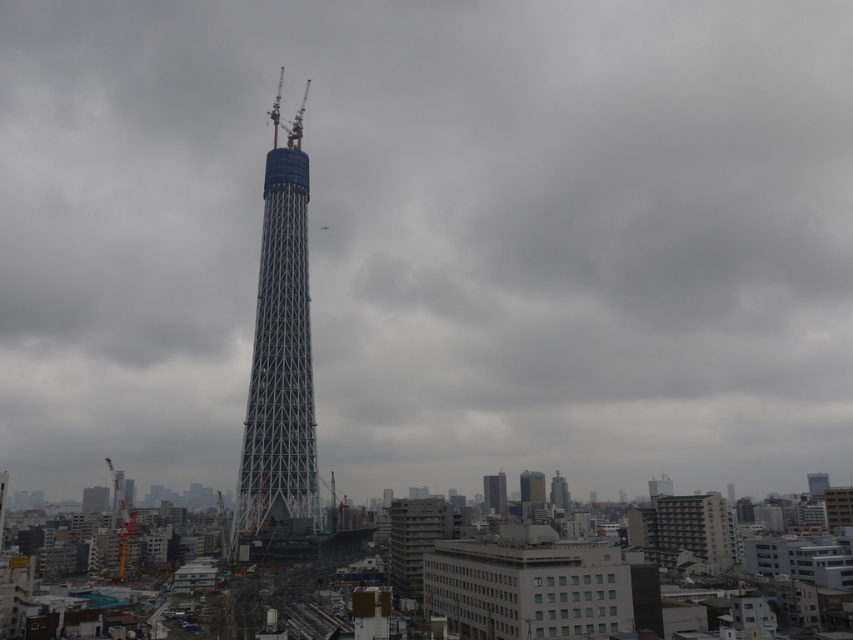
Which of these two, silver metallic tower at center or smooth gray skyscraper at center, stands shorter?

With less height is smooth gray skyscraper at center.

Between silver metallic tower at center and smooth gray skyscraper at center, which one has more height?

Standing taller between the two is silver metallic tower at center.

Find the location of a particular element. Image resolution: width=853 pixels, height=640 pixels. silver metallic tower at center is located at coordinates (280, 358).

Is metallic silver tower at center bigger than smooth gray skyscraper at center?

Yes.

Describe the element at coordinates (494, 493) in the screenshot. I see `metallic silver tower at center` at that location.

The height and width of the screenshot is (640, 853). What do you see at coordinates (494, 493) in the screenshot? I see `metallic silver tower at center` at bounding box center [494, 493].

Locate an element on the screen. metallic silver tower at center is located at coordinates (494, 493).

Does point (248, 448) come behind point (494, 513)?

No, (248, 448) is in front of (494, 513).

Can you confirm if silver metallic tower at center is positioned below metallic silver tower at center?

No, silver metallic tower at center is not below metallic silver tower at center.

This screenshot has width=853, height=640. What do you see at coordinates (280, 358) in the screenshot?
I see `silver metallic tower at center` at bounding box center [280, 358].

Find the location of a particular element. The height and width of the screenshot is (640, 853). silver metallic tower at center is located at coordinates (280, 358).